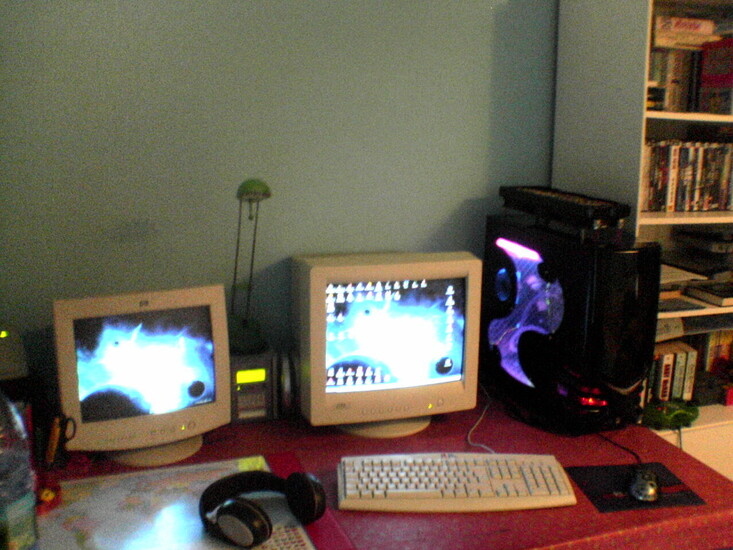
Find the location of a particular element. Image resolution: width=733 pixels, height=550 pixels. 2 computer monitors is located at coordinates (366, 331), (166, 360).